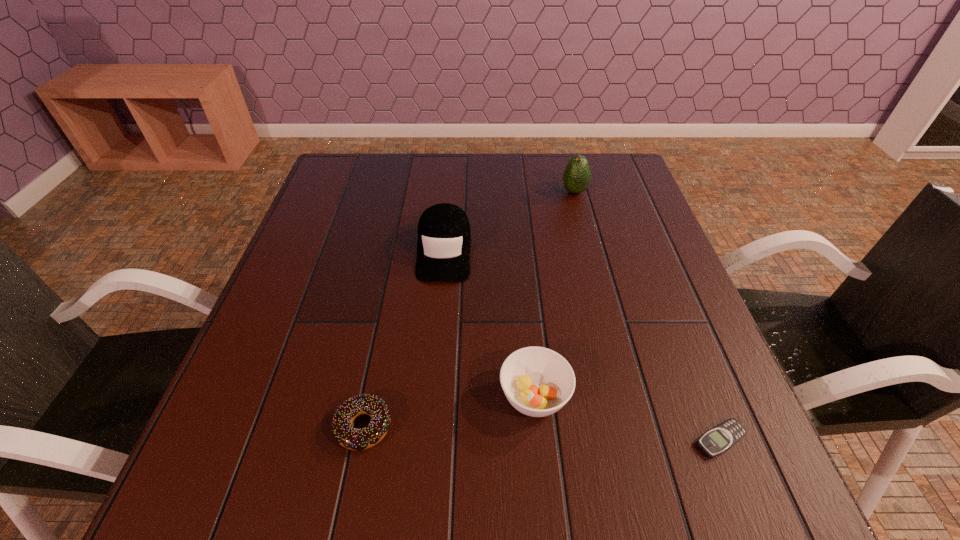
Where is `free space that satisfies the following two spatial constraints: 1. on the back side of the doughnut; 2. on the left side of the third shortest object`? free space that satisfies the following two spatial constraints: 1. on the back side of the doughnut; 2. on the left side of the third shortest object is located at coordinates (370, 396).

Locate an element on the screen. The image size is (960, 540). vacant space that satisfies the following two spatial constraints: 1. on the front-facing side of the soup bowl; 2. on the right side of the second farthest object is located at coordinates (431, 396).